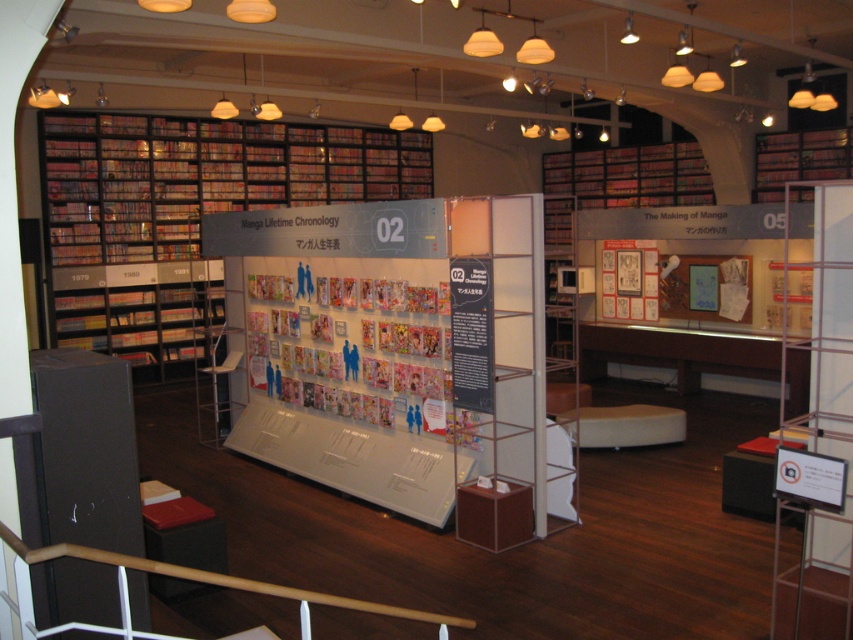
You are a visitor in the museum and want to see both the matte gray display at center and the matte black bookshelf at left. Which one should you look at first to follow the typical viewing path from left to right?

You should look at the matte black bookshelf at left first because it is on the left side of the matte gray display at center, and the typical viewing path follows from left to right.